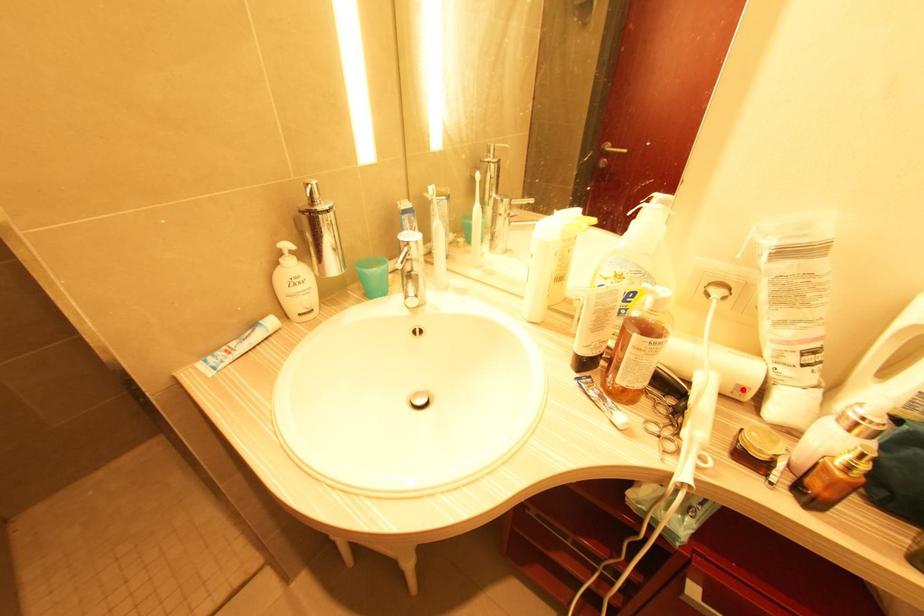
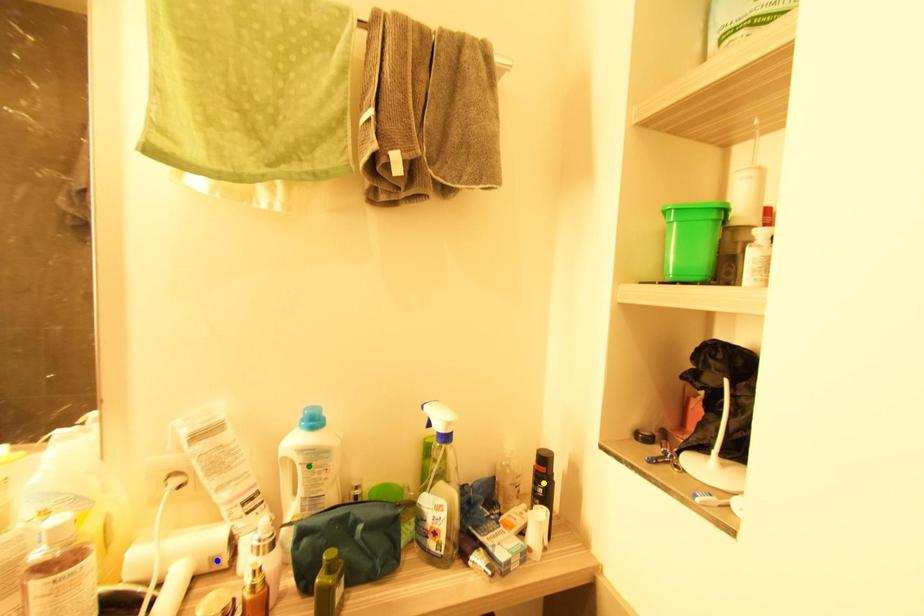
Question: I am providing you with two images of the same scene from different viewpoints. A red point is marked on the first image. You are given multiple points on the second image. Which mark in image 2 goes with the point in image 1?

Choices:
 (A) yellow point
 (B) green point
 (C) blue point

Answer: (C)